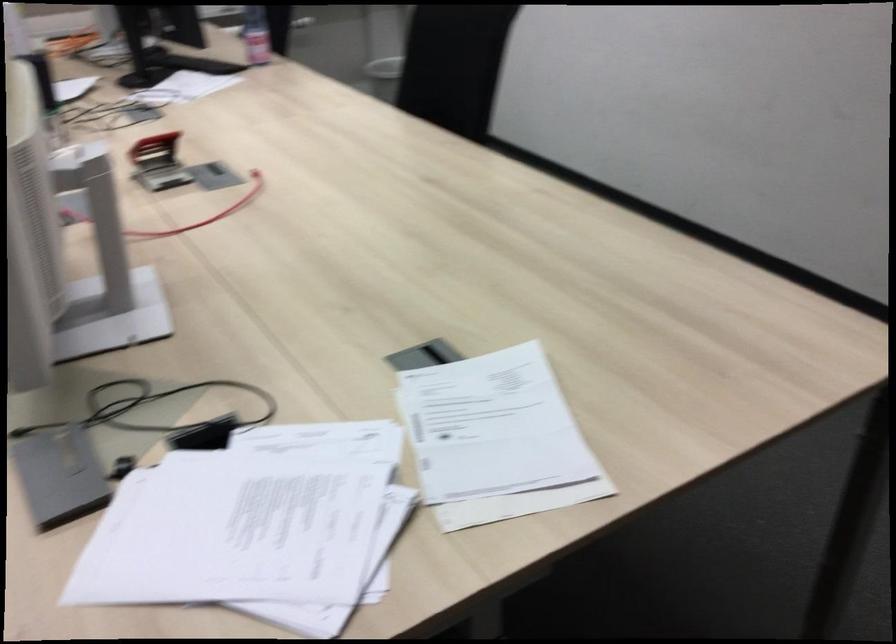
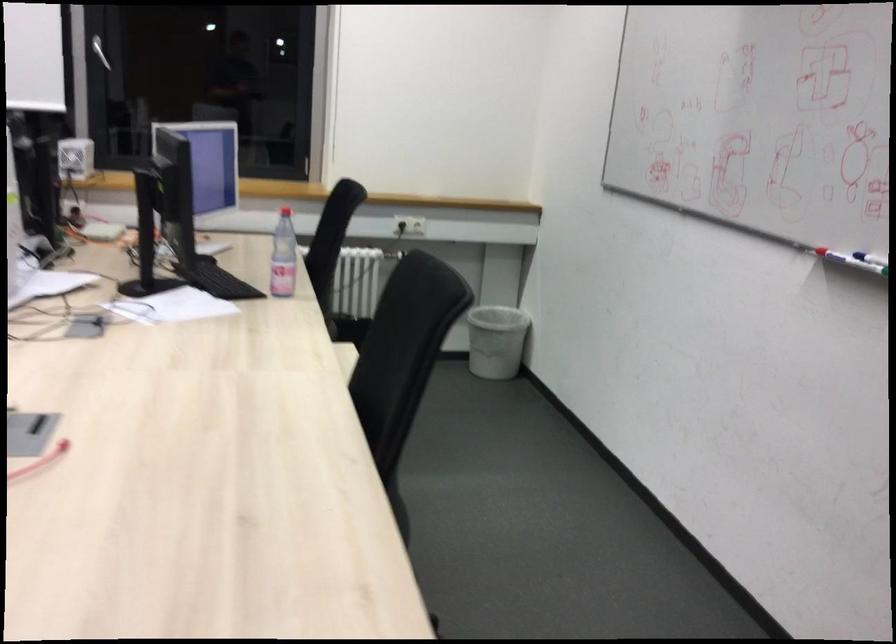
In the scene shown: Which direction would the cameraman need to move to produce the second image?

The cameraman moved toward right, forward.